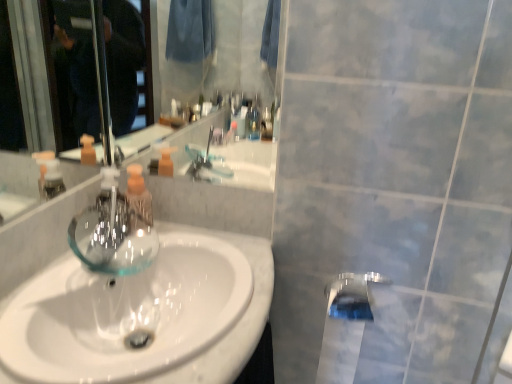
The width and height of the screenshot is (512, 384). Identify the location of free location in front of clear glass faucet at center. (84, 264).